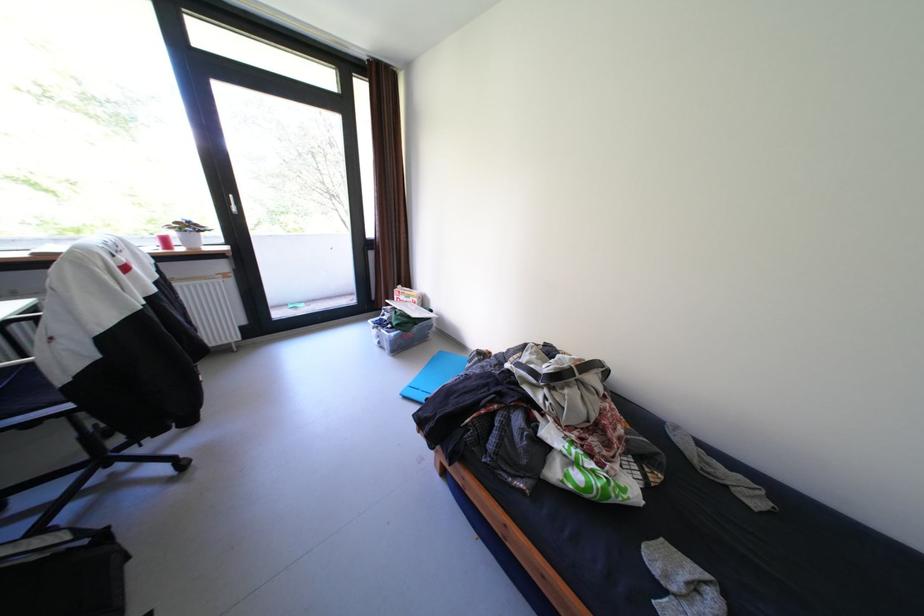
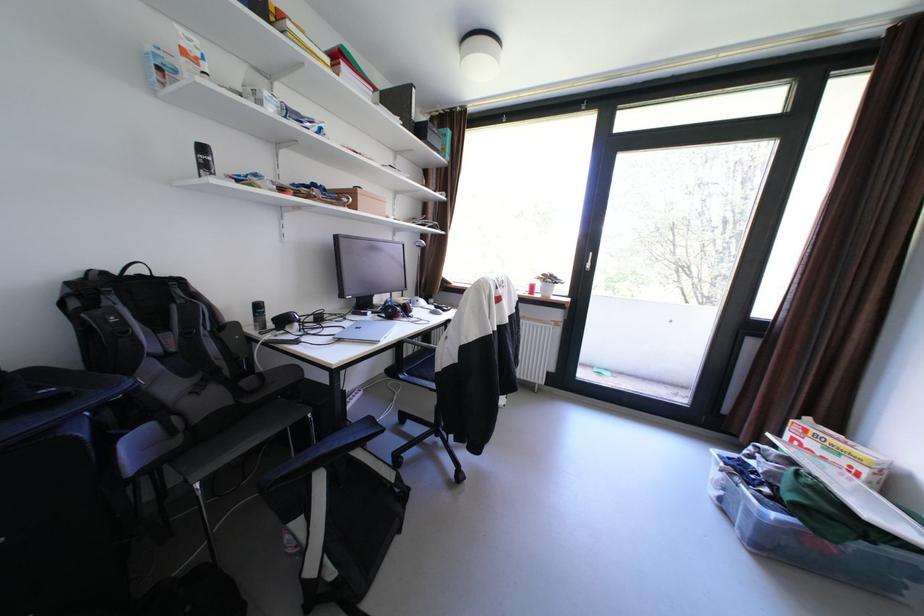
Locate, in the second image, the point that corresponds to pixel 403 334 in the first image.

(784, 516)